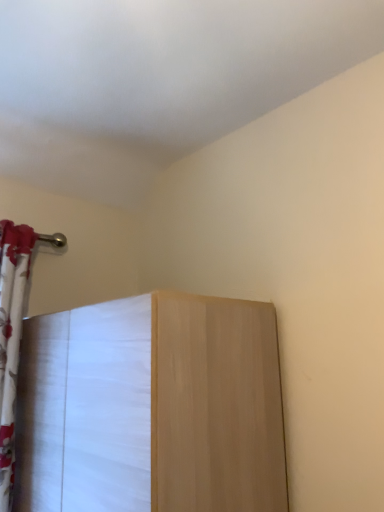
Image resolution: width=384 pixels, height=512 pixels. What do you see at coordinates (151, 408) in the screenshot?
I see `light wood cabinet at center` at bounding box center [151, 408].

Where is `light wood cabinet at center`? The image size is (384, 512). light wood cabinet at center is located at coordinates (151, 408).

What is the approximate height of light wood cabinet at center?

light wood cabinet at center is 28.89 inches in height.

Describe the element at coordinates (11, 341) in the screenshot. Image resolution: width=384 pixels, height=512 pixels. I see `white floral fabric curtain at left` at that location.

Find the location of a particular element. The height and width of the screenshot is (512, 384). white floral fabric curtain at left is located at coordinates (11, 341).

Locate an element on the screen. Image resolution: width=384 pixels, height=512 pixels. light wood cabinet at center is located at coordinates (151, 408).

Does light wood cabinet at center appear on the left side of white floral fabric curtain at left?

Incorrect, light wood cabinet at center is not on the left side of white floral fabric curtain at left.

Between light wood cabinet at center and white floral fabric curtain at left, which one is positioned in front?

Positioned in front is light wood cabinet at center.

Is point (173, 488) farther from camera compared to point (16, 323)?

No, it is not.

From the image's perspective, is light wood cabinet at center below white floral fabric curtain at left?

Yes, from the image's perspective, light wood cabinet at center is below white floral fabric curtain at left.

From a real-world perspective, is light wood cabinet at center on white floral fabric curtain at left?

No.

Between light wood cabinet at center and white floral fabric curtain at left, which one has smaller width?

white floral fabric curtain at left.

Which of these two, light wood cabinet at center or white floral fabric curtain at left, stands taller?

Standing taller between the two is white floral fabric curtain at left.

Considering the sizes of objects light wood cabinet at center and white floral fabric curtain at left in the image provided, who is smaller, light wood cabinet at center or white floral fabric curtain at left?

With smaller size is white floral fabric curtain at left.

Do you think light wood cabinet at center is within white floral fabric curtain at left, or outside of it?

The correct answer is: outside.

Does light wood cabinet at center touch white floral fabric curtain at left?

No, light wood cabinet at center is not with white floral fabric curtain at left.

Is light wood cabinet at center positioned with its back to white floral fabric curtain at left?

No, white floral fabric curtain at left is not at the back of light wood cabinet at center.

Where is `curtain that appears on the left of light wood cabinet at center`? The height and width of the screenshot is (512, 384). curtain that appears on the left of light wood cabinet at center is located at coordinates (11, 341).

Is white floral fabric curtain at left to the left of light wood cabinet at center from the viewer's perspective?

Correct, you'll find white floral fabric curtain at left to the left of light wood cabinet at center.

Looking at this image, between white floral fabric curtain at left and light wood cabinet at center, which one is positioned in front?

light wood cabinet at center.

Which point is more distant from viewer, (13,469) or (198,318)?

Point (13,469)

From the image's perspective, which is above, white floral fabric curtain at left or light wood cabinet at center?

white floral fabric curtain at left is shown above in the image.

From a real-world perspective, is white floral fabric curtain at left positioned above or below light wood cabinet at center?

Clearly, from a real-world perspective, white floral fabric curtain at left is above light wood cabinet at center.

Does white floral fabric curtain at left have a lesser width compared to light wood cabinet at center?

Indeed, white floral fabric curtain at left has a lesser width compared to light wood cabinet at center.

In the scene shown: Can you confirm if white floral fabric curtain at left is shorter than light wood cabinet at center?

No.

Considering the relative sizes of white floral fabric curtain at left and light wood cabinet at center in the image provided, is white floral fabric curtain at left bigger than light wood cabinet at center?

Incorrect, white floral fabric curtain at left is not larger than light wood cabinet at center.

Is light wood cabinet at center located within white floral fabric curtain at left?

That's incorrect, light wood cabinet at center is not inside white floral fabric curtain at left.

Is white floral fabric curtain at left in contact with light wood cabinet at center?

There is a gap between white floral fabric curtain at left and light wood cabinet at center.

Is light wood cabinet at center at the back of white floral fabric curtain at left?

white floral fabric curtain at left is not turned away from light wood cabinet at center.

Locate an element on the screen. curtain lying above the light wood cabinet at center (from the image's perspective) is located at coordinates coord(11,341).

Where is `furniture below the white floral fabric curtain at left (from a real-world perspective)`? furniture below the white floral fabric curtain at left (from a real-world perspective) is located at coordinates (151, 408).

Find the location of a particular element. The image size is (384, 512). furniture located on the right of white floral fabric curtain at left is located at coordinates (151, 408).